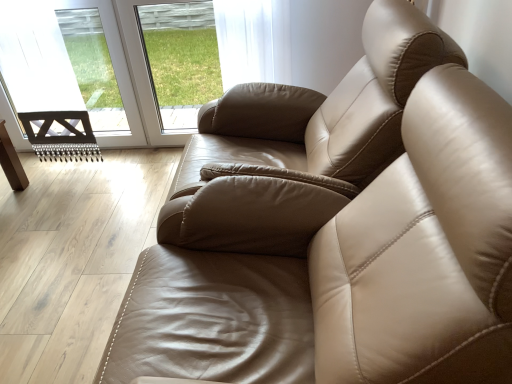
Question: Is satin beige armchair at center situated inside transparent glass door at upper left or outside?

Choices:
 (A) inside
 (B) outside

Answer: (B)

Question: Is satin beige armchair at center in front of or behind transparent glass door at upper left in the image?

Choices:
 (A) front
 (B) behind

Answer: (A)

Question: Which object is positioned farthest from the transparent glass door at upper left?

Choices:
 (A) transparent glass window at upper center
 (B) satin beige armchair at center

Answer: (B)

Question: Based on their relative distances, which object is farther from the satin beige armchair at center?

Choices:
 (A) transparent glass window at upper center
 (B) transparent glass door at upper left

Answer: (A)